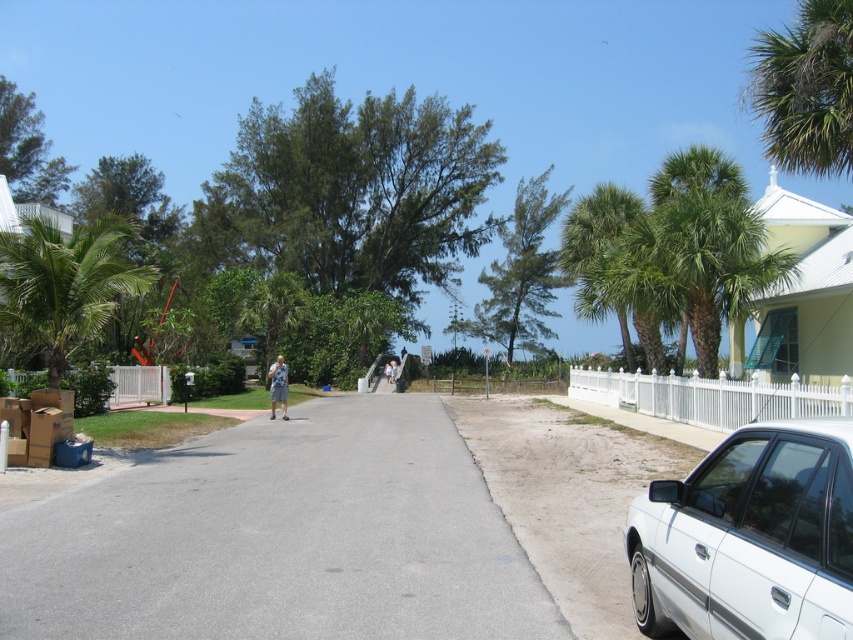
You are standing at the center of the road and want to walk towards the green leafy palm tree at left. Which direction should you face?

The green leafy palm tree at left is located at point 0.444 on the x axis and 0.077 on the y axis. Since you are at the center of the road, you should face towards the left direction to walk towards it.

You are a pedestrian standing on the road and see the green leafy palm tree at upper right and the light blue denim shorts at center. Which object is taller?

The green leafy palm tree at upper right is taller than the light blue denim shorts at center.